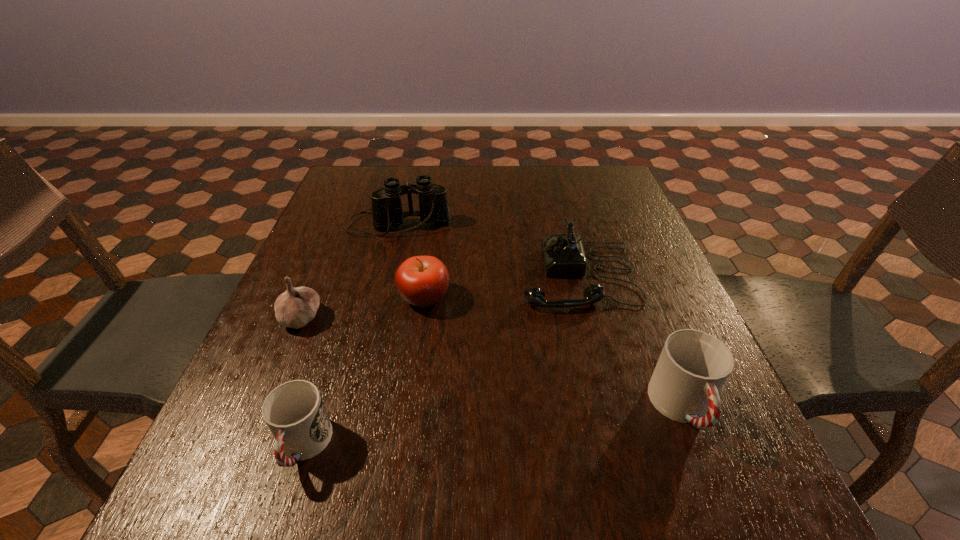
What are the coordinates of `empty location between the telephone and the apple` in the screenshot? It's located at (501, 286).

Image resolution: width=960 pixels, height=540 pixels. In order to click on free space between the garlic and the apple in this screenshot , I will do `click(363, 307)`.

Identify the location of vacant space in between the binoculars and the garlic. The height and width of the screenshot is (540, 960). (349, 271).

Select which object is the fifth closest to the telephone. Please provide its 2D coordinates. Your answer should be formatted as a tuple, i.e. [(x, y)], where the tuple contains the x and y coordinates of a point satisfying the conditions above.

[(297, 306)]

Identify the location of object that is the third nearest to the binoculars. (297, 306).